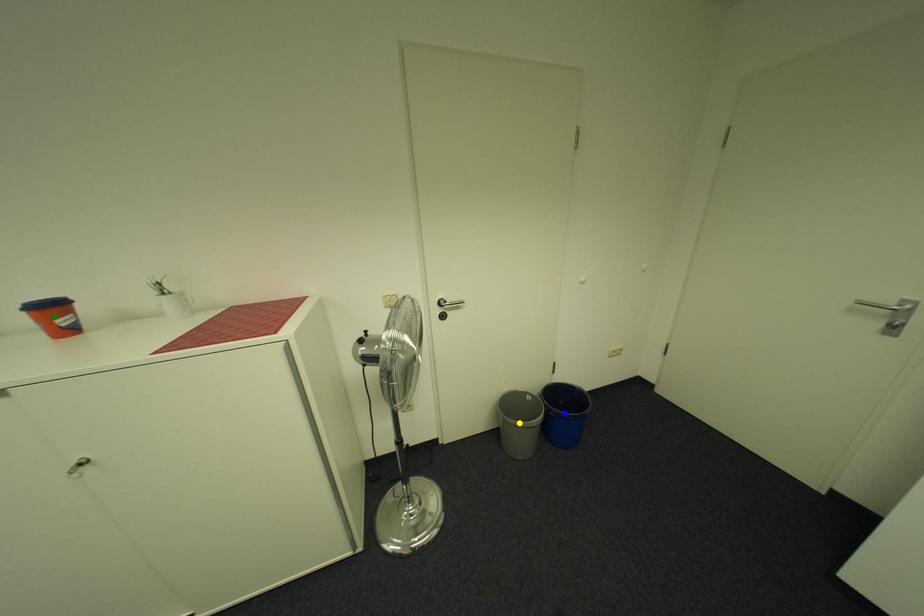
Order these from nearest to farthest:
green point, blue point, yellow point

blue point → yellow point → green point